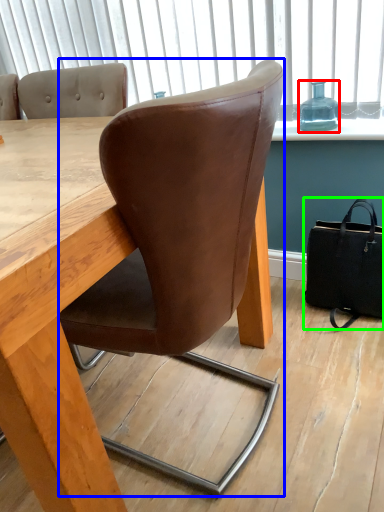
Question: Based on their relative distances, which object is farther from bottle (highlighted by a red box)? Choose from chair (highlighted by a blue box) and handbag (highlighted by a green box).

Choices:
 (A) chair
 (B) handbag

Answer: (A)